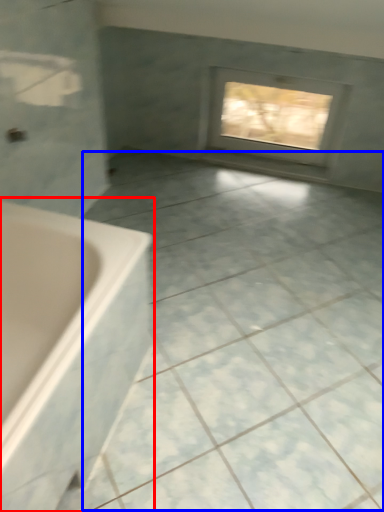
Question: Which point is closer to the camera, bathtub (highlighted by a red box) or ceramic tile (highlighted by a blue box)?

Choices:
 (A) bathtub
 (B) ceramic tile

Answer: (A)